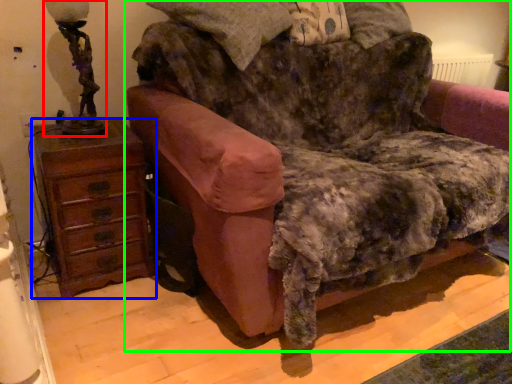
Question: Which object is positioned closest to table lamp (highlighted by a red box)? Select from chest of drawers (highlighted by a blue box) and furniture (highlighted by a green box).

Choices:
 (A) chest of drawers
 (B) furniture

Answer: (A)